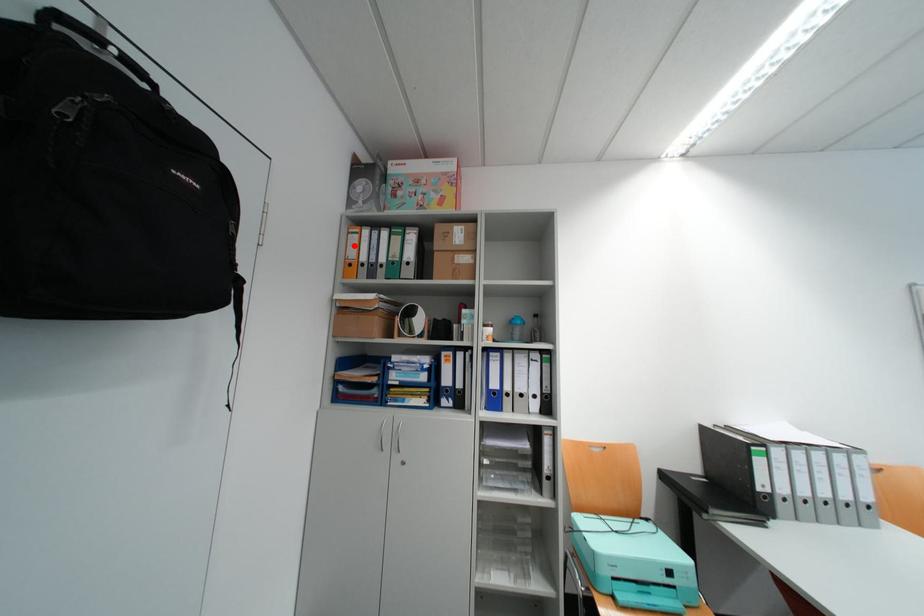
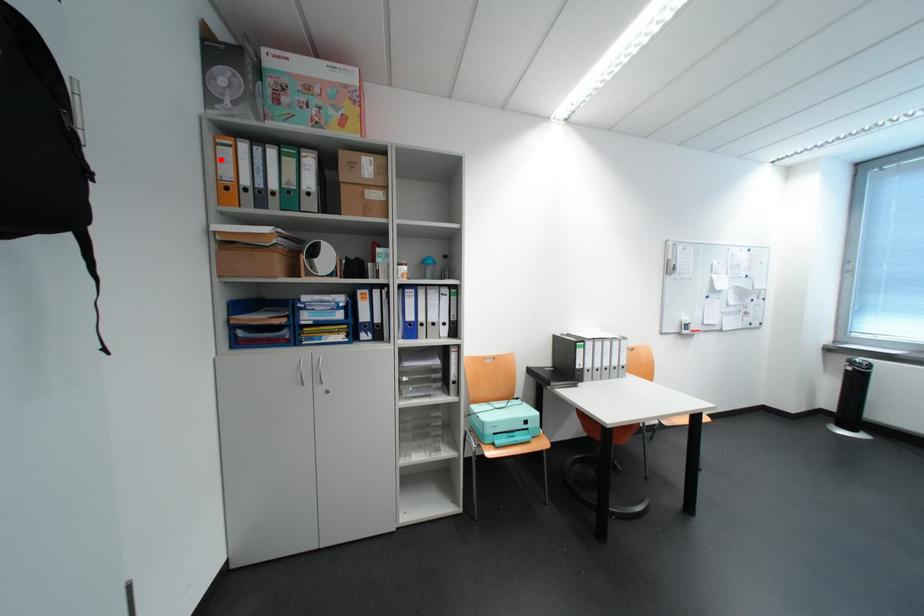
I am providing you with two images of the same scene from different viewpoints. A red point is marked on the first image and another point is marked on the second image. Do the highlighted points in image1 and image2 indicate the same real-world spot?

Yes